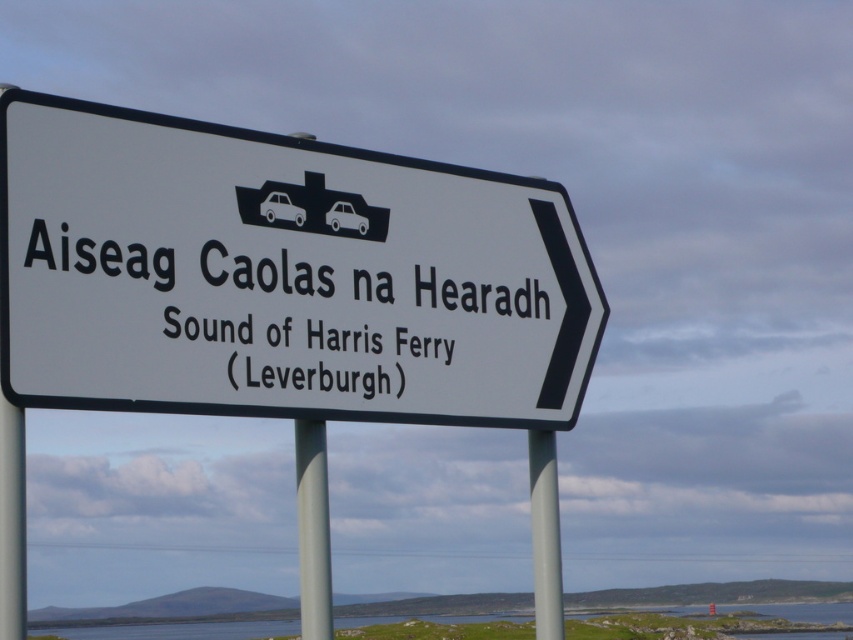
What do you see at coordinates (39, 244) in the screenshot? This screenshot has height=640, width=853. I see `white paper sign at center` at bounding box center [39, 244].

Does point (257, 276) come farther from viewer compared to point (550, 595)?

No, it is in front of (550, 595).

Locate an element on the screen. The height and width of the screenshot is (640, 853). white paper sign at center is located at coordinates (39, 244).

Between white paper sign at center and white plastic pole at left, which one appears on the left side from the viewer's perspective?

Positioned to the left is white plastic pole at left.

Between point (38, 220) and point (16, 579), which one is positioned in front?

Point (16, 579)

This screenshot has width=853, height=640. What do you see at coordinates (39, 244) in the screenshot? I see `white paper sign at center` at bounding box center [39, 244].

Where is `white paper sign at center`? white paper sign at center is located at coordinates (39, 244).

Measure the distance between point (26, 397) and camera.

Point (26, 397) is 10.68 meters from camera.

Does white plastic sign at center appear under gray metallic pole at center?

Actually, white plastic sign at center is above gray metallic pole at center.

I want to click on white plastic sign at center, so point(280,276).

The width and height of the screenshot is (853, 640). In order to click on white plastic sign at center in this screenshot , I will do `click(280, 276)`.